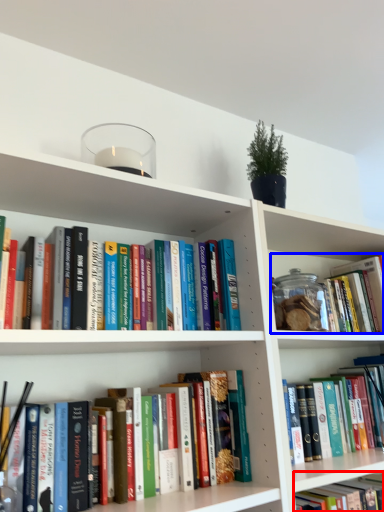
Question: Among these objects, which one is nearest to the camera, book (highlighted by a red box) or book (highlighted by a blue box)?

Choices:
 (A) book
 (B) book

Answer: (A)